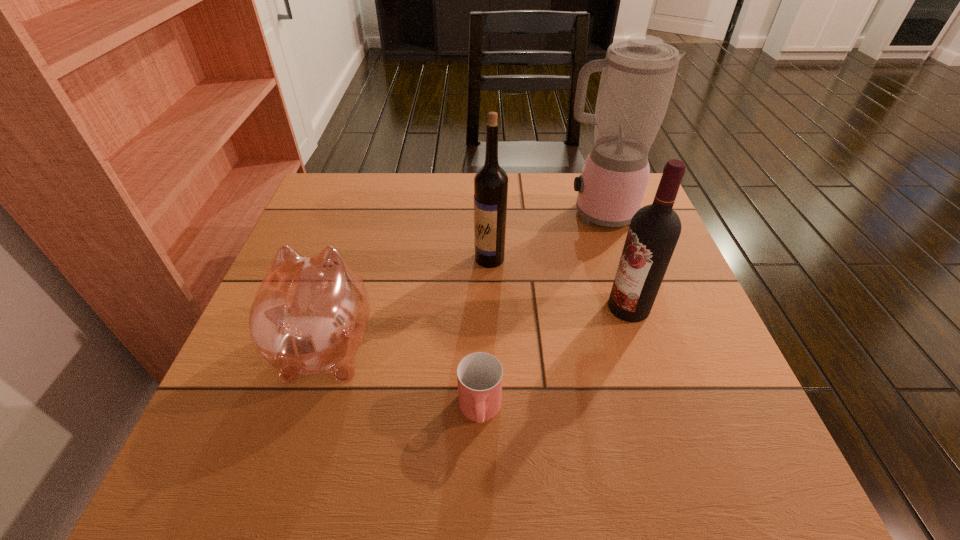
Where is `vacant area situated 0.170m on the base of the food processor near the control knob`? vacant area situated 0.170m on the base of the food processor near the control knob is located at coordinates (495, 213).

Identify the location of vacant space located on the label of the farther wine bottle. (429, 259).

The image size is (960, 540). Find the location of `free space located 0.350m on the label of the farther wine bottle`. free space located 0.350m on the label of the farther wine bottle is located at coordinates (328, 259).

What are the coordinates of `blank space located on the label of the farther wine bottle` in the screenshot? It's located at (387, 259).

Locate an element on the screen. The width and height of the screenshot is (960, 540). free space located 0.150m on the label of the right wine bottle is located at coordinates point(538,307).

Identify the location of vacant position located 0.110m on the label of the right wine bottle. (557, 307).

Find the location of a particular element. free space located 0.180m on the label of the right wine bottle is located at coordinates (524, 307).

At what (x,y) coordinates should I click in order to perform the action: click on free space located on the front facing side of the leftmost object. Please return your answer as a coordinate pair (x, y). This screenshot has height=540, width=960. Looking at the image, I should click on (346, 283).

This screenshot has width=960, height=540. Find the location of `free space located on the front facing side of the leftmost object`. free space located on the front facing side of the leftmost object is located at coordinates (346, 283).

Locate an element on the screen. The image size is (960, 540). free space located on the front facing side of the leftmost object is located at coordinates (355, 251).